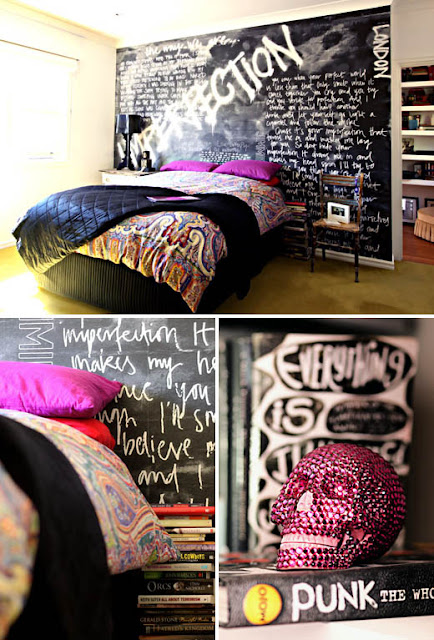
Image resolution: width=434 pixels, height=640 pixels. What are the coordinates of `black lampshade` in the screenshot? It's located at (123, 118).